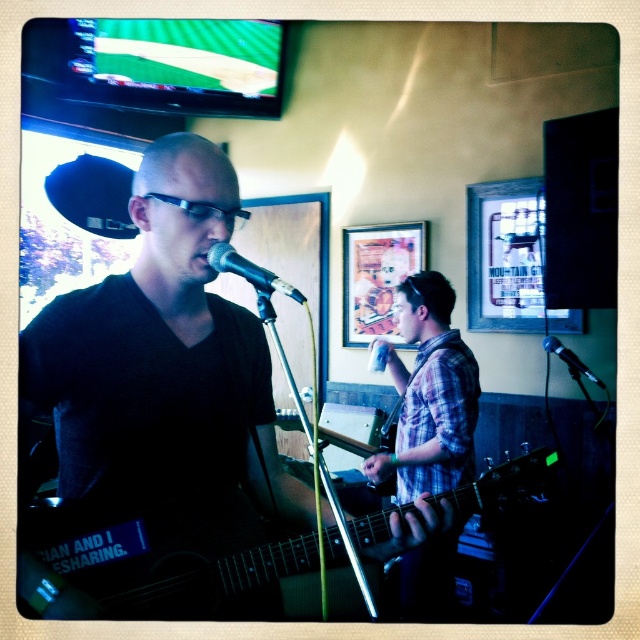
Question: Based on their relative distances, which object is farther from the black matte guitar at center?

Choices:
 (A) metallic silver microphone at center
 (B) black metallic microphone at right
 (C) plaid fabric shirt at center
 (D) acoustic wood guitar at center

Answer: (B)

Question: Can you confirm if acoustic wood guitar at center is wider than black metallic microphone at right?

Choices:
 (A) yes
 (B) no

Answer: (A)

Question: Considering the real-world distances, which object is closest to the plaid fabric shirt at center?

Choices:
 (A) metallic silver microphone at center
 (B) acoustic wood guitar at center
 (C) black matte guitar at center

Answer: (B)

Question: Is acoustic wood guitar at center above plaid fabric shirt at center?

Choices:
 (A) yes
 (B) no

Answer: (B)

Question: Which of the following is the closest to the observer?

Choices:
 (A) black metallic microphone at right
 (B) metallic silver microphone at center
 (C) black matte guitar at center

Answer: (B)

Question: Does metallic silver microphone at center appear over black metallic microphone at right?

Choices:
 (A) no
 (B) yes

Answer: (B)